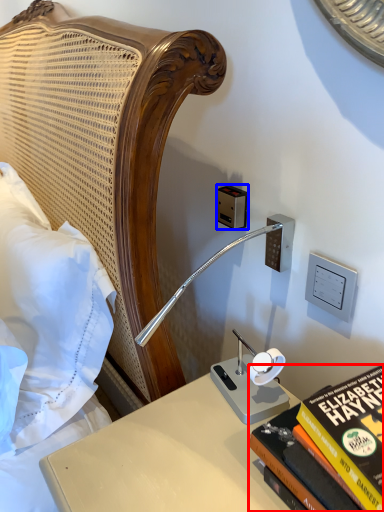
Question: Which of the following is the farthest to the observer, book (highlighted by a red box) or electric outlet (highlighted by a blue box)?

Choices:
 (A) book
 (B) electric outlet

Answer: (B)